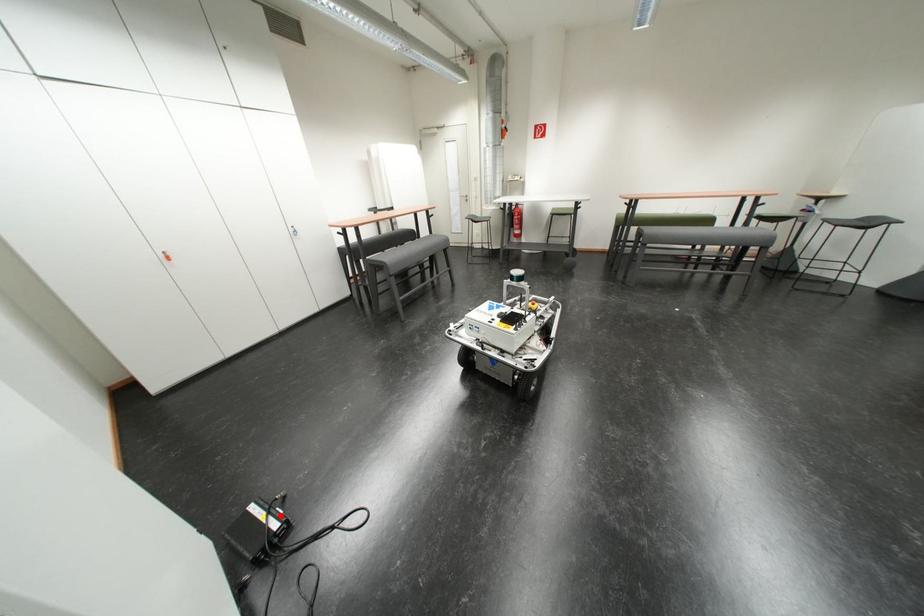
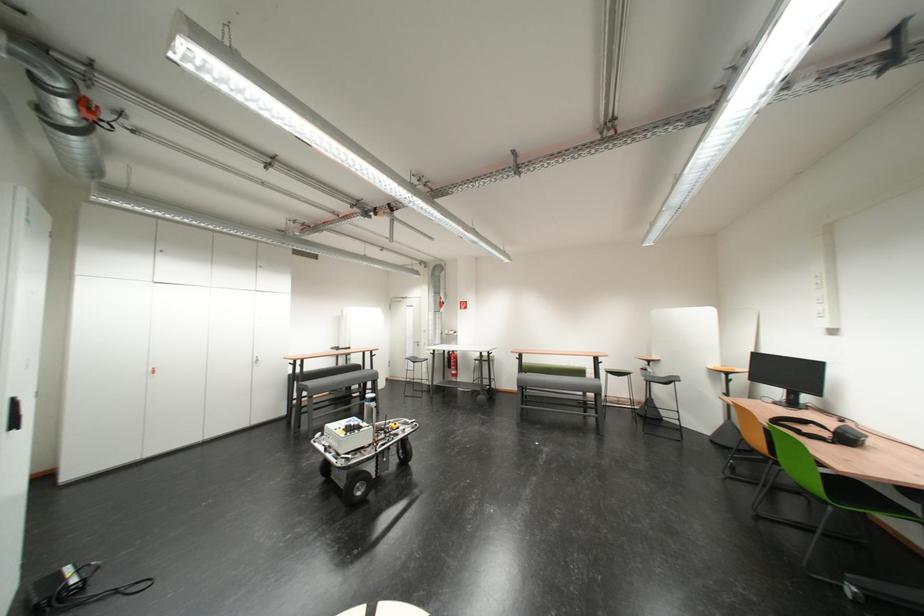
Question: I am providing you with two images of the same scene from different viewpoints. A red point is marked on the first image. Can you still see the location of the red point in image 2?

Choices:
 (A) Yes
 (B) No

Answer: (A)